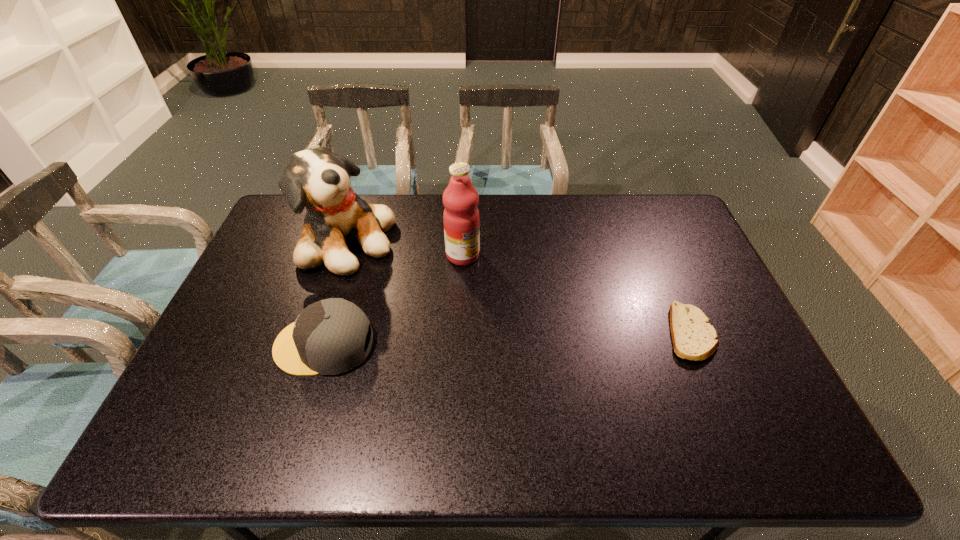
This screenshot has width=960, height=540. Identify the location of the second shortest object. (328, 337).

Identify the location of the rightmost object. This screenshot has height=540, width=960. (694, 338).

The height and width of the screenshot is (540, 960). What are the coordinates of `the shortest object` in the screenshot? It's located at (694, 338).

At what (x,y) coordinates should I click in order to perform the action: click on fruit juice. Please return your answer as a coordinate pair (x, y). Looking at the image, I should click on (461, 218).

Identify the location of puppy. The image size is (960, 540). (316, 178).

I want to click on vacant position located 0.060m on the front-facing side of the cap, so click(253, 344).

This screenshot has width=960, height=540. I want to click on vacant space positioned 0.160m on the front-facing side of the cap, so click(216, 344).

Identify the location of vacant space situated on the front-facing side of the cap. (256, 344).

Identify the location of free space located on the back of the rightmost object. (648, 232).

Identify the location of vacant space situated on the label of the third object from left to right. Image resolution: width=960 pixels, height=540 pixels. (494, 284).